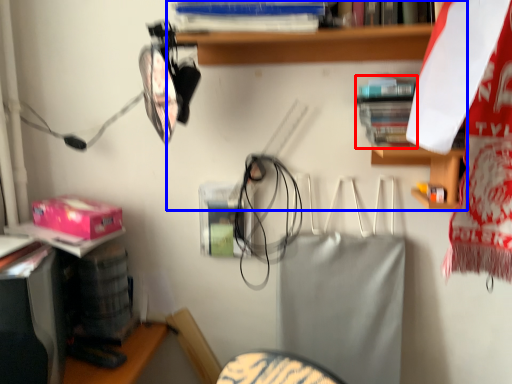
Question: Which object appears farthest to the camera in this image, book (highlighted by a red box) or shelf (highlighted by a blue box)?

Choices:
 (A) book
 (B) shelf

Answer: (A)